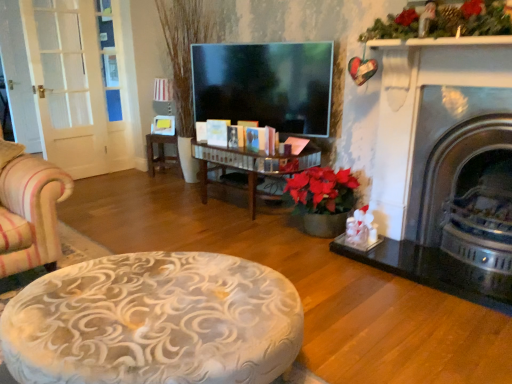
Question: Considering the positions of wooden table at center and shiny silver fireplace at right in the image, is wooden table at center taller or shorter than shiny silver fireplace at right?

Choices:
 (A) tall
 (B) short

Answer: (B)

Question: Relative to shiny silver fireplace at right, is wooden table at center in front or behind?

Choices:
 (A) front
 (B) behind

Answer: (B)

Question: Is point (160, 152) positioned closer to the camera than point (438, 158)?

Choices:
 (A) farther
 (B) closer

Answer: (A)

Question: Would you say shiny silver fireplace at right is to the left or to the right of wooden table at center in the picture?

Choices:
 (A) right
 (B) left

Answer: (A)

Question: From a real-world perspective, is shiny silver fireplace at right physically located above or below wooden table at center?

Choices:
 (A) above
 (B) below

Answer: (A)

Question: Considering the positions of shiny silver fireplace at right and wooden table at center in the image, is shiny silver fireplace at right taller or shorter than wooden table at center?

Choices:
 (A) short
 (B) tall

Answer: (B)

Question: Would you say shiny silver fireplace at right is inside or outside wooden table at center?

Choices:
 (A) outside
 (B) inside

Answer: (A)